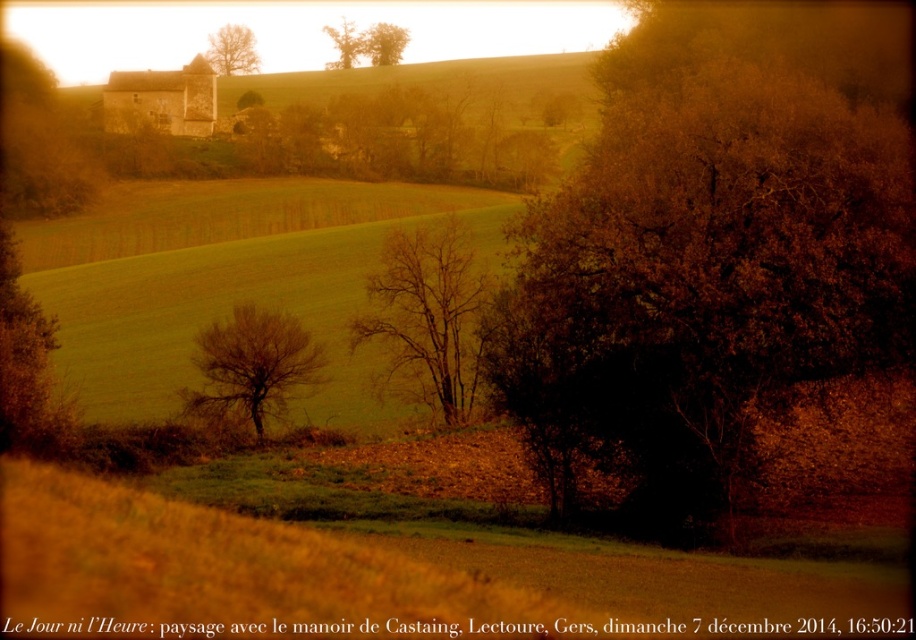
Question: Can you confirm if green leafy tree at upper center is thinner than smooth brown tree at upper center?

Choices:
 (A) no
 (B) yes

Answer: (B)

Question: Which object is positioned closest to the brown textured tree at center?

Choices:
 (A) green grass at center
 (B) bare branches at upper center

Answer: (A)

Question: Does brown textured tree at center appear on the left side of brown leafless tree at center?

Choices:
 (A) no
 (B) yes

Answer: (A)

Question: Is green grass at center positioned behind green leafy tree at upper center?

Choices:
 (A) yes
 (B) no

Answer: (B)

Question: Which object appears farthest from the camera in this image?

Choices:
 (A) brown leafless tree at center
 (B) brown textured tree at center
 (C) green leafy tree at upper center

Answer: (C)

Question: Which object is positioned closest to the bare branches at center?

Choices:
 (A) green grass at center
 (B) brown textured tree at upper center
 (C) bare branches at upper center
 (D) green leafy tree at upper center

Answer: (A)